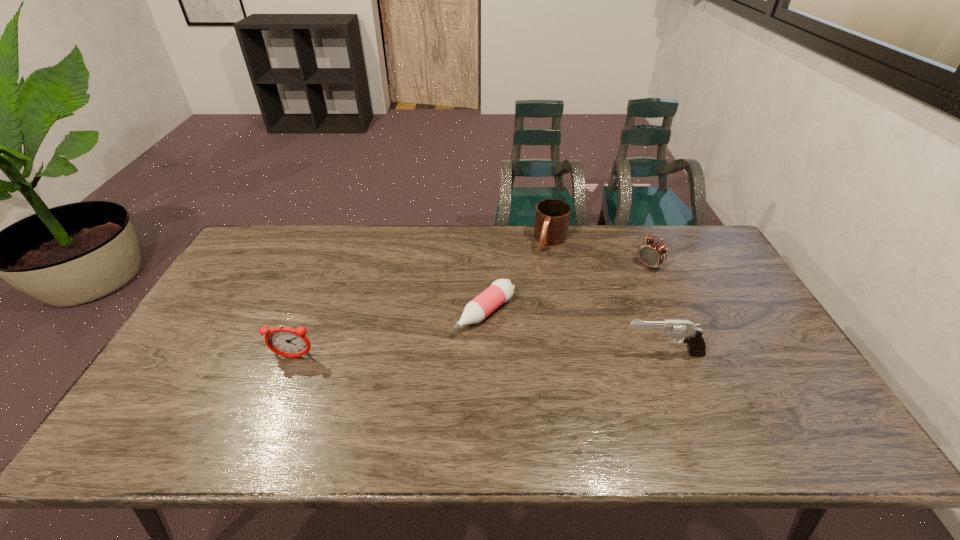
Locate an element on the screen. The image size is (960, 540). vacant space located on the face of the second farthest object is located at coordinates (575, 321).

This screenshot has height=540, width=960. In order to click on vacant position located 0.350m on the face of the second farthest object in this screenshot , I will do `click(572, 323)`.

Where is `mug that is at the far edge`? mug that is at the far edge is located at coordinates (552, 216).

The width and height of the screenshot is (960, 540). I want to click on alarm clock that is at the far edge, so click(x=652, y=253).

Locate an element on the screen. The width and height of the screenshot is (960, 540). blank space at the far edge is located at coordinates (598, 229).

Where is `vacant point at the near edge`? Image resolution: width=960 pixels, height=540 pixels. vacant point at the near edge is located at coordinates (517, 383).

Where is `free space at the left edge`? The width and height of the screenshot is (960, 540). free space at the left edge is located at coordinates (262, 301).

Find the location of a particular element. This screenshot has height=540, width=960. vacant region at the right edge is located at coordinates (712, 272).

At what (x,y) coordinates should I click in order to perform the action: click on free space between the gun and the second object from left to right. Please return your answer as a coordinate pair (x, y). This screenshot has height=540, width=960. Looking at the image, I should click on (574, 333).

Where is `free space that is in between the left alarm clock and the third object from right to left`? This screenshot has height=540, width=960. free space that is in between the left alarm clock and the third object from right to left is located at coordinates (422, 299).